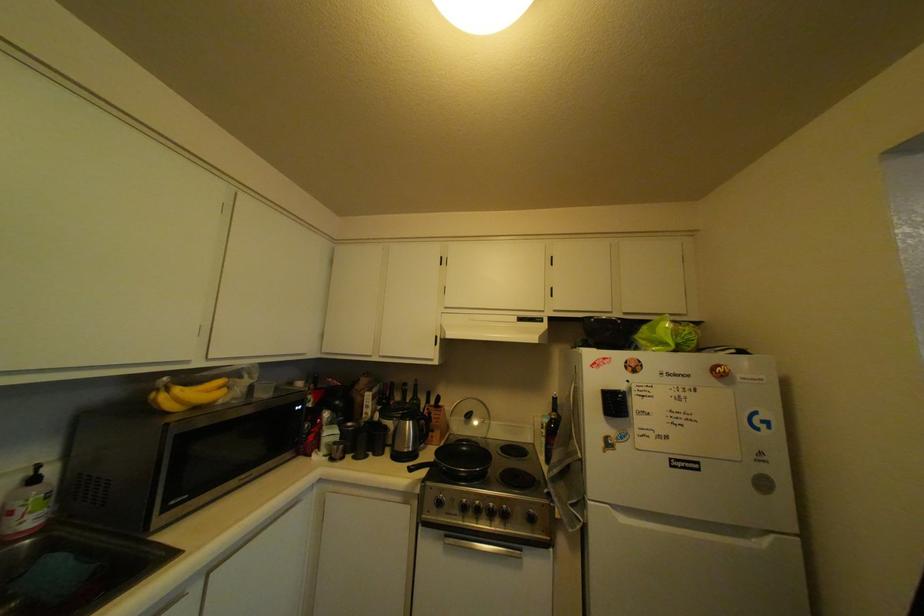
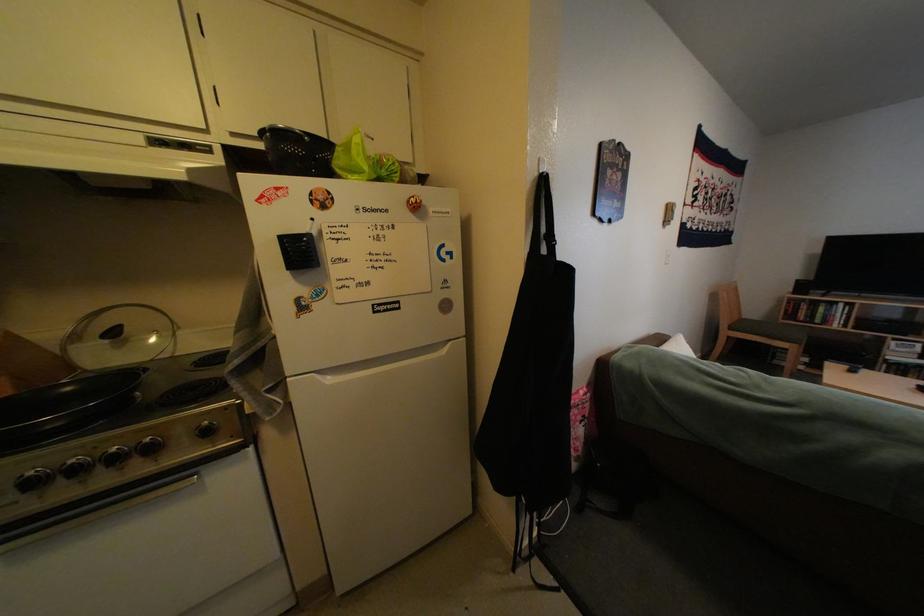
In the second image, find the point that corresponds to point (492, 504) in the first image.

(88, 463)